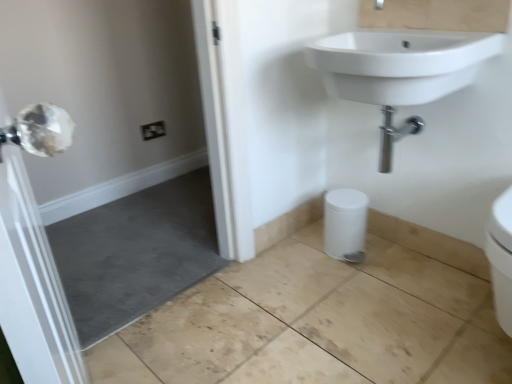
Question: Can you confirm if clear glass door at left is shorter than white matte bidet at lower center?

Choices:
 (A) no
 (B) yes

Answer: (A)

Question: Does clear glass door at left have a greater height compared to white matte bidet at lower center?

Choices:
 (A) yes
 (B) no

Answer: (A)

Question: Considering the relative sizes of clear glass door at left and white matte bidet at lower center in the image provided, is clear glass door at left bigger than white matte bidet at lower center?

Choices:
 (A) no
 (B) yes

Answer: (B)

Question: Considering the relative positions of clear glass door at left and white matte bidet at lower center in the image provided, is clear glass door at left to the right of white matte bidet at lower center from the viewer's perspective?

Choices:
 (A) no
 (B) yes

Answer: (A)

Question: Can you confirm if clear glass door at left is smaller than white matte bidet at lower center?

Choices:
 (A) yes
 (B) no

Answer: (B)

Question: Is white matte bidet at lower center inside clear glass door at left?

Choices:
 (A) yes
 (B) no

Answer: (B)

Question: From the image's perspective, is clear glass door at left on top of white ceramic sink at upper right?

Choices:
 (A) no
 (B) yes

Answer: (A)

Question: Is clear glass door at left positioned beyond the bounds of white ceramic sink at upper right?

Choices:
 (A) no
 (B) yes

Answer: (B)

Question: Considering the relative positions of clear glass door at left and white ceramic sink at upper right in the image provided, is clear glass door at left to the left of white ceramic sink at upper right from the viewer's perspective?

Choices:
 (A) yes
 (B) no

Answer: (A)

Question: Is clear glass door at left wider than white ceramic sink at upper right?

Choices:
 (A) yes
 (B) no

Answer: (B)

Question: From a real-world perspective, is clear glass door at left located higher than white ceramic sink at upper right?

Choices:
 (A) no
 (B) yes

Answer: (A)

Question: From the image's perspective, is clear glass door at left located beneath white ceramic sink at upper right?

Choices:
 (A) yes
 (B) no

Answer: (A)

Question: Can you confirm if white matte bidet at lower center is thinner than white ceramic sink at upper right?

Choices:
 (A) no
 (B) yes

Answer: (B)